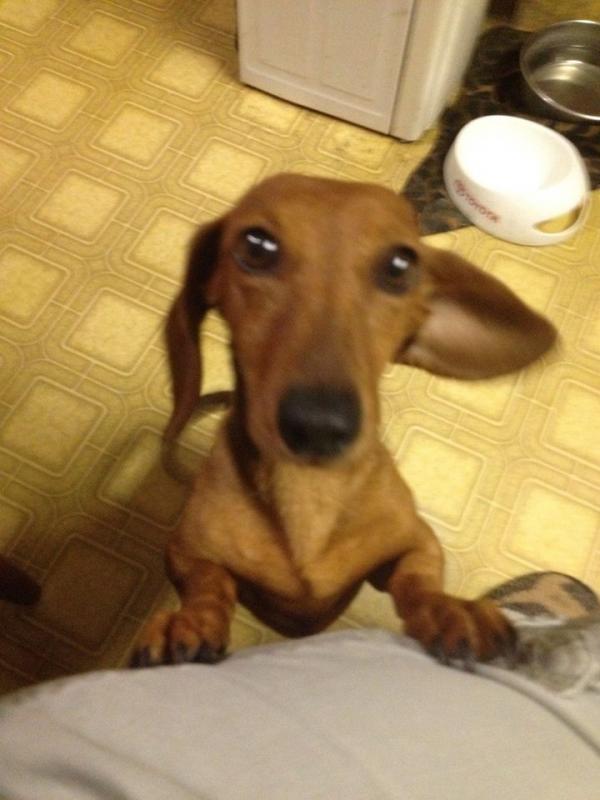
Where is `nasty yellowish floor`? The height and width of the screenshot is (800, 600). nasty yellowish floor is located at coordinates (98, 98).